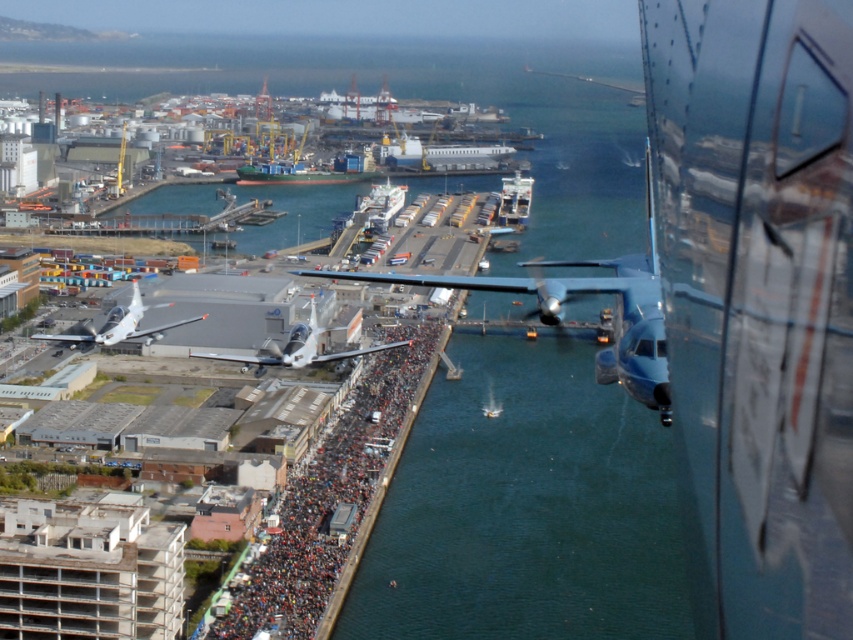
Question: Considering the real-world distances, which object is farthest from the metallic blue airplane at center?

Choices:
 (A) white glossy airplane at center
 (B) green water at center
 (C) dark gray concrete crowd at center

Answer: (C)

Question: Is metallic blue airplane at center wider than silver metallic airplane at lower left?

Choices:
 (A) yes
 (B) no

Answer: (A)

Question: Among these objects, which one is farthest from the camera?

Choices:
 (A) dark gray concrete crowd at center
 (B) green water at center

Answer: (B)

Question: Does metallic blue airplane at center have a lesser width compared to white glossy airplane at center?

Choices:
 (A) no
 (B) yes

Answer: (A)

Question: Which is farther from the dark gray concrete crowd at center?

Choices:
 (A) silver metallic airplane at lower left
 (B) metallic blue airplane at center
 (C) white glossy airplane at center

Answer: (A)

Question: Is green water at center below white glossy airplane at center?

Choices:
 (A) yes
 (B) no

Answer: (A)